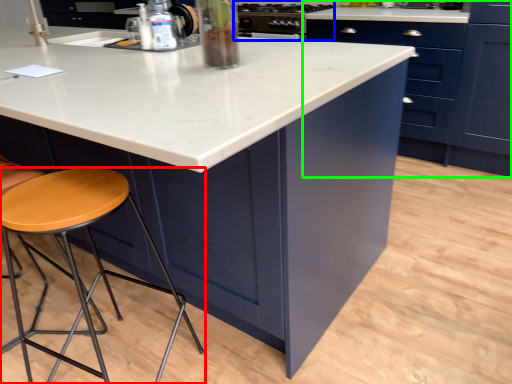
Question: Estimate the real-world distances between objects in this image. Which object is farther from stool (highlighted by a red box), appliance (highlighted by a blue box) or cabinetry (highlighted by a green box)?

Choices:
 (A) appliance
 (B) cabinetry

Answer: (B)